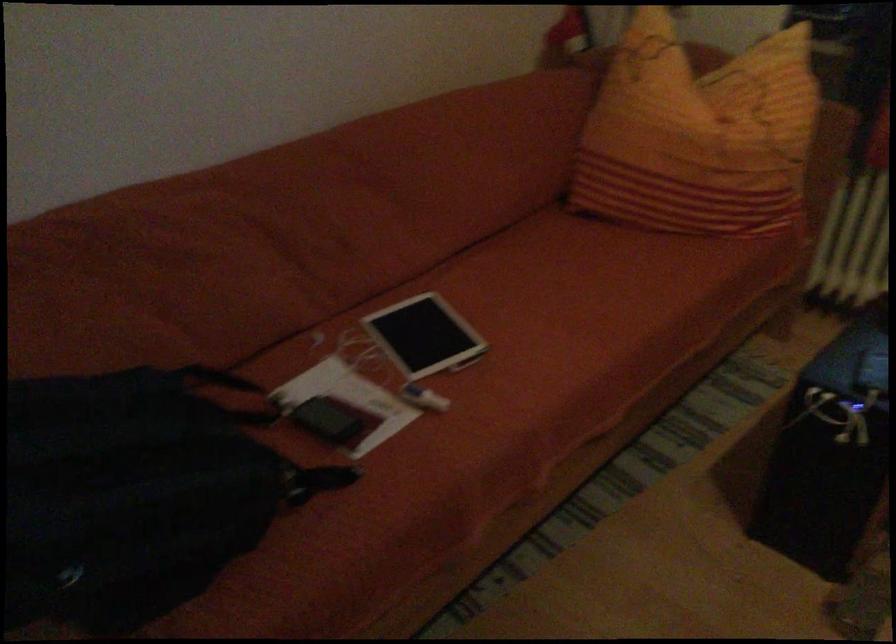
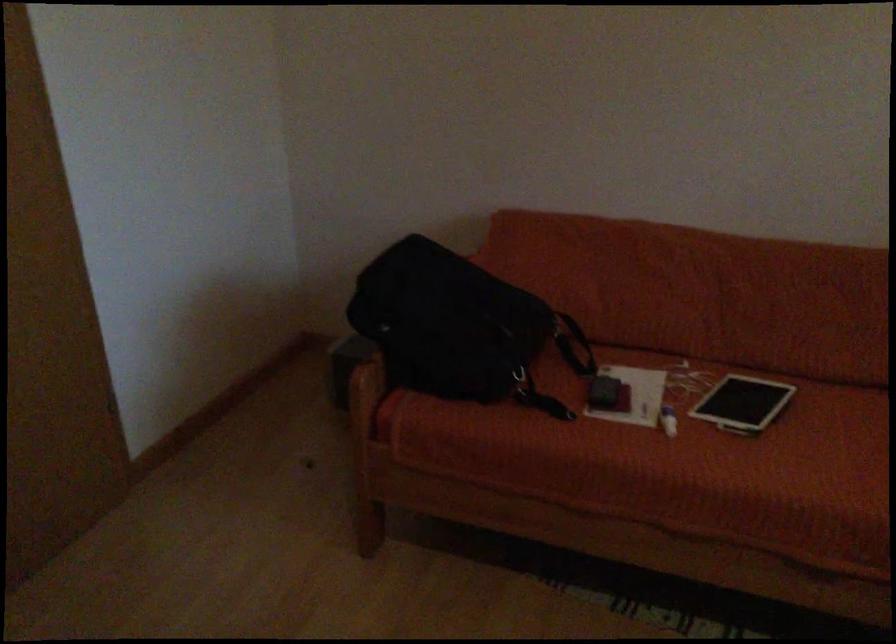
Find the pixel in the second image that matches [434,400] in the first image.

(668, 420)